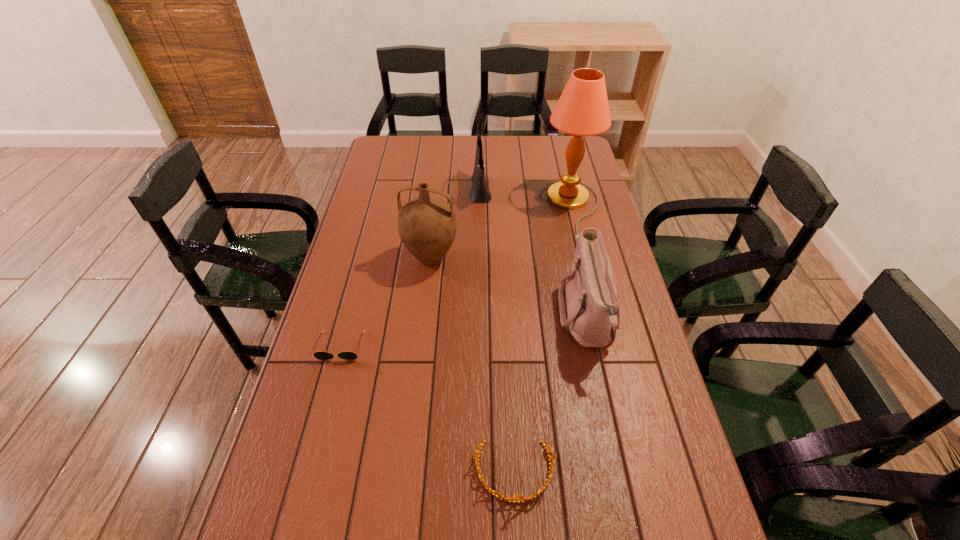
Locate an element on the screen. the tallest object is located at coordinates (582, 110).

The image size is (960, 540). Find the location of `the second object from left to right`. the second object from left to right is located at coordinates (427, 225).

Locate an element on the screen. the taller shoulder bag is located at coordinates (479, 193).

What are the coordinates of `the farther shoulder bag` in the screenshot? It's located at (479, 193).

In order to click on the shorter shoulder bag in this screenshot , I will do `click(589, 305)`.

The width and height of the screenshot is (960, 540). Identify the location of the nearer shoulder bag. (589, 305).

At what (x,y) coordinates should I click in order to perform the action: click on the nearest object. Please return your answer as a coordinate pair (x, y). The width and height of the screenshot is (960, 540). Looking at the image, I should click on (521, 498).

At what (x,y) coordinates should I click in order to perform the action: click on the second shortest object. Please return your answer as a coordinate pair (x, y). Image resolution: width=960 pixels, height=540 pixels. Looking at the image, I should click on (521, 498).

Locate an element on the screen. The height and width of the screenshot is (540, 960). the shortest object is located at coordinates [x=321, y=355].

Find the location of `sunglasses`. sunglasses is located at coordinates (321, 355).